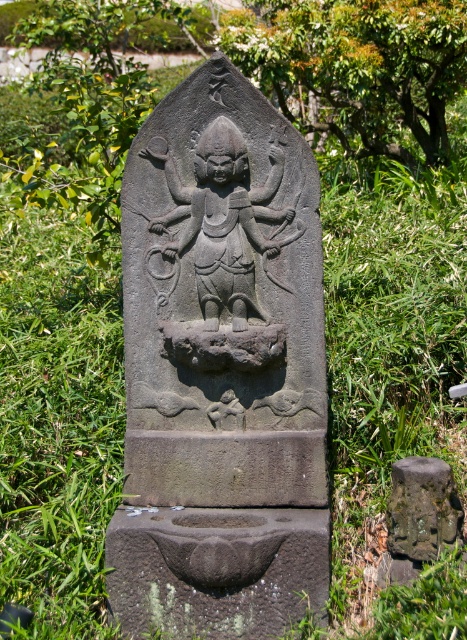
In the scene shown: You are an archaeologist examining the monument. You notice the gray stone statue at center and the black stone deity at center. Which one is nearer to you?

The gray stone statue at center is closer to the viewer than the black stone deity at center.

You are an archaeologist examining the monument. You notice the gray stone statue at center and the black stone deity at center. Which one is positioned to the right of the other?

The gray stone statue at center is to the right of the black stone deity at center.

You are standing in front of a stone monument in a green area. There is a point marked at coordinates (220, 369). What does this point indicate?

The point at coordinates (220, 369) marks the gray stone statue at center.